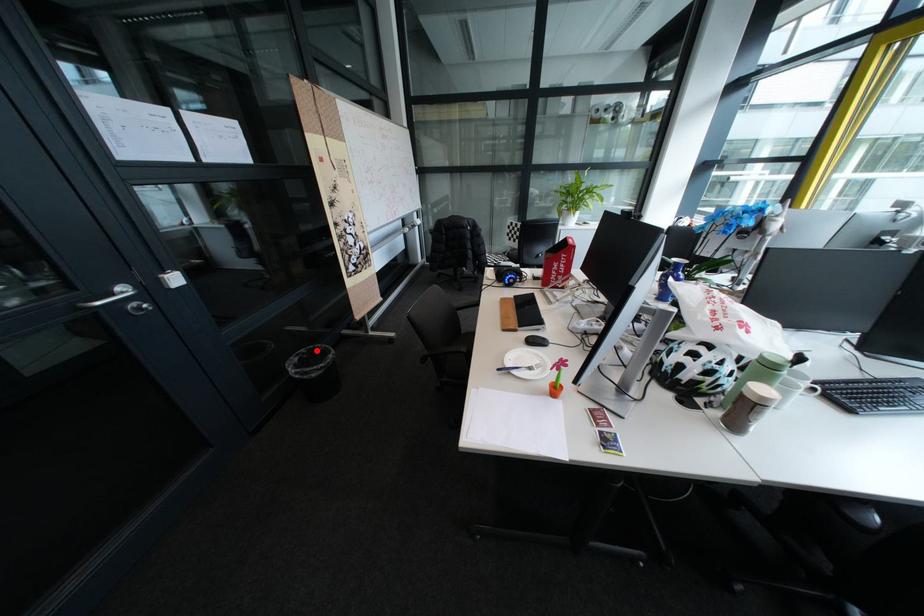
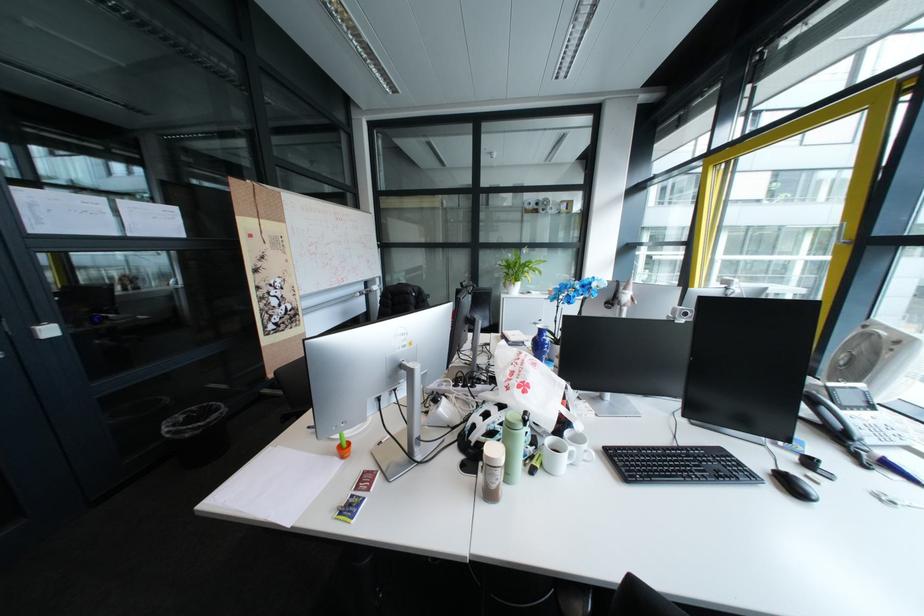
Question: A red point is marked in image1. In image2, is the corresponding 3D point closer to the camera or farther? Reply with the corresponding letter.

Choices:
 (A) The corresponding 3D point is closer.
 (B) The corresponding 3D point is farther.

Answer: (B)